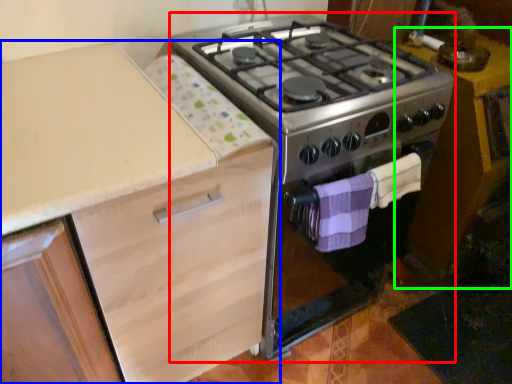
Question: Based on their relative distances, which object is farther from appliance (highlighted by a red box)? Choose from cabinetry (highlighted by a blue box) and table (highlighted by a green box).

Choices:
 (A) cabinetry
 (B) table

Answer: (B)